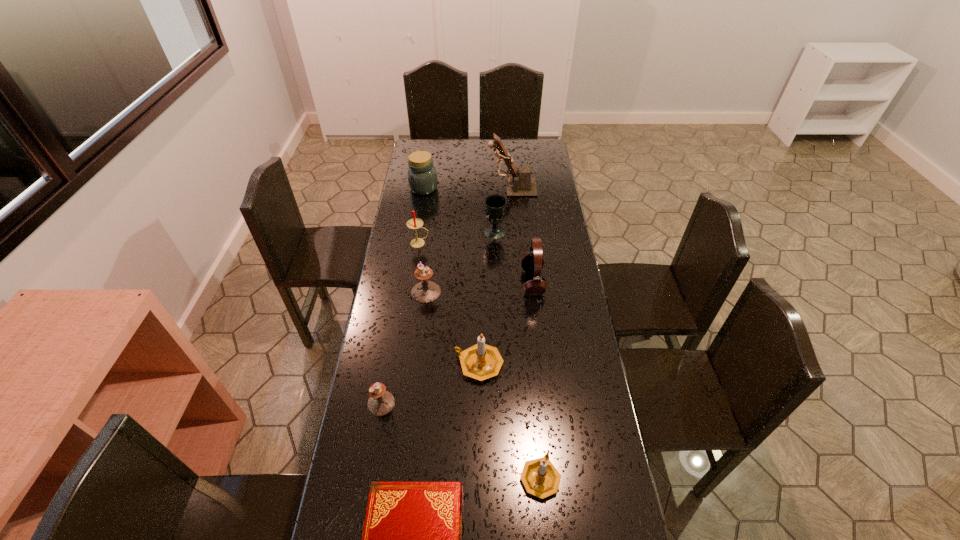
Find the location of a particular element. The width and height of the screenshot is (960, 540). free space between the candle and the chalice is located at coordinates (457, 238).

This screenshot has width=960, height=540. Identify the location of free spot between the rightmost candle holder and the chalice. (517, 355).

The image size is (960, 540). Find the location of `free spot between the jar and the tallest object`. free spot between the jar and the tallest object is located at coordinates pos(468,188).

Where is `blank region between the chalice and the candle`? blank region between the chalice and the candle is located at coordinates (457, 238).

Locate which object ranks second in proximity to the bigger gold candle holder. Please provide its 2D coordinates. Your answer should be formatted as a tuple, i.e. [(x, y)], where the tuple contains the x and y coordinates of a point satisfying the conditions above.

[(424, 292)]

Where is `object that stands as the seventh closest to the nearest candle holder`? This screenshot has width=960, height=540. object that stands as the seventh closest to the nearest candle holder is located at coordinates (415, 223).

Find the location of `candle holder that stands as the second closest to the farther purple candle holder`. candle holder that stands as the second closest to the farther purple candle holder is located at coordinates (381, 402).

This screenshot has width=960, height=540. In order to click on the closest candle holder to the smaller purple candle holder in this screenshot , I will do `click(481, 361)`.

Identify the location of vacant region that satisfies the following two spatial constraints: 1. on the front-facing side of the tallest object; 2. on the front side of the chalice. The image size is (960, 540). (516, 233).